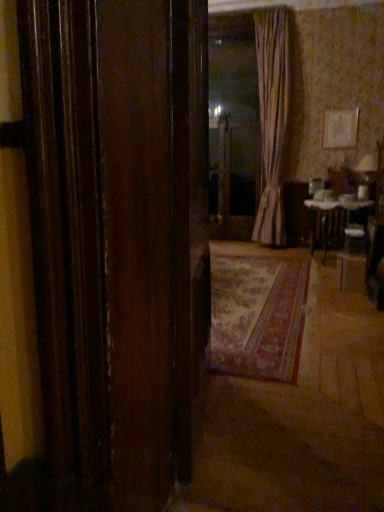
In order to click on transparent glass door at center in this screenshot , I will do `click(233, 126)`.

What do you see at coordinates (330, 219) in the screenshot? The image size is (384, 512). I see `white glossy table at center` at bounding box center [330, 219].

Image resolution: width=384 pixels, height=512 pixels. What do you see at coordinates (118, 238) in the screenshot?
I see `wooden door at center` at bounding box center [118, 238].

Identify the location of transparent glass door at center. (233, 126).

From the image's perspective, is transparent glass door at center above or below white glossy table at center?

transparent glass door at center is situated higher than white glossy table at center in the image.

Is transparent glass door at center facing towards white glossy table at center?

No, transparent glass door at center is not aimed at white glossy table at center.

Relative to striped fabric curtain at center, is white glossy table at center in front or behind?

Visually, white glossy table at center is located in front of striped fabric curtain at center.

From the image's perspective, is white glossy table at center above striped fabric curtain at center?

No, from the image's perspective, white glossy table at center is not on top of striped fabric curtain at center.

Is white glossy table at center turned away from striped fabric curtain at center?

white glossy table at center does not have its back to striped fabric curtain at center.

From a real-world perspective, is white glossy table at center located beneath striped fabric curtain at center?

Indeed, from a real-world perspective, white glossy table at center is positioned beneath striped fabric curtain at center.

Between wooden door at center and white glossy table at center, which one has more height?

wooden door at center is taller.

Between wooden door at center and white glossy table at center, which one has larger width?

white glossy table at center is wider.

From a real-world perspective, is wooden door at center on top of white glossy table at center?

Yes, from a real-world perspective, wooden door at center is on top of white glossy table at center.

Does wooden door at center come behind white glossy table at center?

No.

Is point (187, 30) farther from viewer compared to point (238, 217)?

No.

Who is smaller, wooden door at center or transparent glass door at center?

transparent glass door at center is smaller.

Is wooden door at center not within transparent glass door at center?

wooden door at center is positioned outside transparent glass door at center.

Is white glossy table at center oriented towards transparent glass door at center?

No.

Considering the relative sizes of white glossy table at center and transparent glass door at center in the image provided, is white glossy table at center smaller than transparent glass door at center?

No.

Is white glossy table at center closer to the viewer compared to transparent glass door at center?

Yes, white glossy table at center is closer to the viewer.

Is white glossy table at center taller than transparent glass door at center?

No.

Based on the photo, can you tell me how much striped fabric curtain at center and white glossy table at center differ in facing direction?

85.5 degrees.

Choose the correct answer: Is striped fabric curtain at center inside white glossy table at center or outside it?

striped fabric curtain at center is not enclosed by white glossy table at center.

Based on the photo, from a real-world perspective, is striped fabric curtain at center on white glossy table at center?

Yes, from a real-world perspective, striped fabric curtain at center is on top of white glossy table at center.

Between striped fabric curtain at center and white glossy table at center, which one appears on the left side from the viewer's perspective?

striped fabric curtain at center.

Can you confirm if white glossy table at center is wider than wooden door at center?

Yes, white glossy table at center is wider than wooden door at center.

From a real-world perspective, which object stands above the other?

wooden door at center, from a real-world perspective.

Can you confirm if white glossy table at center is positioned to the left of wooden door at center?

In fact, white glossy table at center is to the right of wooden door at center.

Looking at this image, is white glossy table at center looking in the opposite direction of wooden door at center?

No, white glossy table at center is not facing the opposite direction of wooden door at center.

Image resolution: width=384 pixels, height=512 pixels. In the image, there is a transparent glass door at center. Identify the location of table below it (from a real-world perspective). (330, 219).

Identify the location of curtain above the white glossy table at center (from a real-world perspective). (272, 119).

Looking at the image, which one is located closer to wooden door at center, white glossy table at center or transparent glass door at center?

white glossy table at center lies closer to wooden door at center than the other object.

When comparing their distances from transparent glass door at center, does striped fabric curtain at center or white glossy table at center seem further?

white glossy table at center is further to transparent glass door at center.

When comparing their distances from white glossy table at center, does wooden door at center or striped fabric curtain at center seem further?

wooden door at center lies further to white glossy table at center than the other object.

When comparing their distances from striped fabric curtain at center, does transparent glass door at center or wooden door at center seem further?

Based on the image, wooden door at center appears to be further to striped fabric curtain at center.

From the image, which object appears to be farther from striped fabric curtain at center, wooden door at center or white glossy table at center?

wooden door at center lies further to striped fabric curtain at center than the other object.

Based on their spatial positions, is wooden door at center or striped fabric curtain at center closer to transparent glass door at center?

The object closer to transparent glass door at center is striped fabric curtain at center.

Which object lies further to the anchor point transparent glass door at center, wooden door at center or white glossy table at center?

wooden door at center lies further to transparent glass door at center than the other object.

Based on their spatial positions, is white glossy table at center or striped fabric curtain at center closer to transparent glass door at center?

The object closer to transparent glass door at center is striped fabric curtain at center.

You are a GUI agent. You are given a task and a screenshot of the screen. Output one action in this format:
    pyautogui.click(x=<x>, y=<y>)
    Task: Click on the table between wooden door at center and striped fabric curtain at center from front to back
    The image size is (384, 512).
    Given the screenshot: What is the action you would take?
    pyautogui.click(x=330, y=219)

Where is `curtain between white glossy table at center and transparent glass door at center along the z-axis`? curtain between white glossy table at center and transparent glass door at center along the z-axis is located at coordinates (272, 119).

Where is `curtain between wooden door at center and transparent glass door at center from front to back`? curtain between wooden door at center and transparent glass door at center from front to back is located at coordinates (272, 119).

This screenshot has width=384, height=512. In order to click on table between wooden door at center and transparent glass door at center from front to back in this screenshot , I will do `click(330, 219)`.